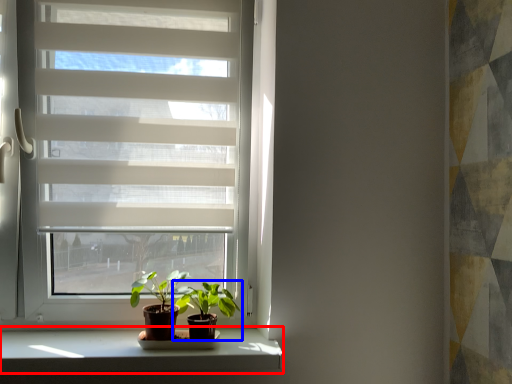
Question: Which point is closer to the camera, window sill (highlighted by a red box) or houseplant (highlighted by a blue box)?

Choices:
 (A) window sill
 (B) houseplant

Answer: (A)